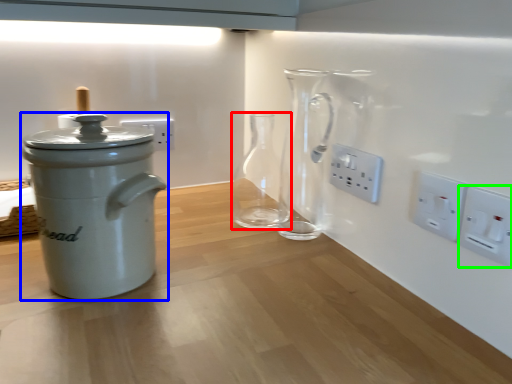
Question: Estimate the real-world distances between objects in this image. Which object is farther from glass vase (highlighted by a red box), kitchen appliance (highlighted by a blue box) or electric outlet (highlighted by a green box)?

Choices:
 (A) kitchen appliance
 (B) electric outlet

Answer: (B)